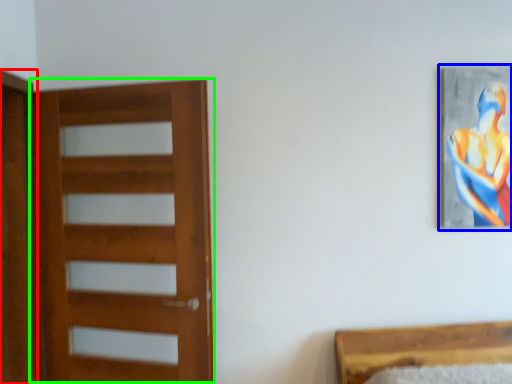
Question: Which object is the closest to the screen door (highlighted by a red box)? Choose among these: picture frame (highlighted by a blue box) or door (highlighted by a green box).

Choices:
 (A) picture frame
 (B) door

Answer: (B)